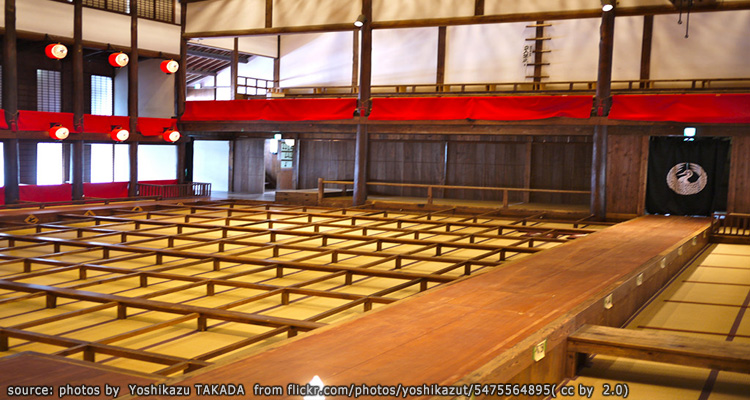
Locate an element on the screen. The image size is (750, 400). white cloth is located at coordinates (483, 40).